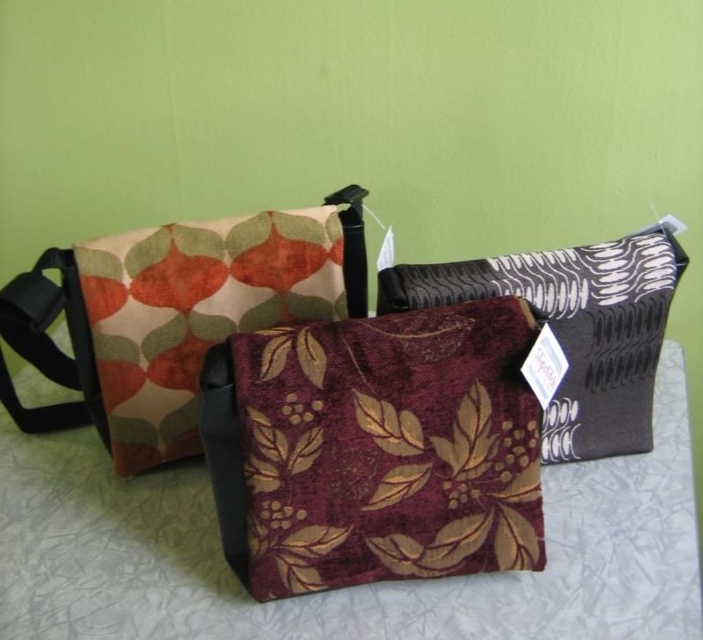
Is burgundy velvety pouch at center smaller than burgundy velvet pouch at center?

Yes.

Can you confirm if burgundy velvety pouch at center is bigger than burgundy velvet pouch at center?

No.

Does point (200, 387) come farther from viewer compared to point (645, 362)?

No, (200, 387) is in front of (645, 362).

This screenshot has width=703, height=640. In order to click on burgundy velvety pouch at center in this screenshot , I will do `click(375, 449)`.

Which is more to the left, burgundy velvet pouch at center or velvety floral pouch at center?

velvety floral pouch at center

Does burgundy velvet pouch at center have a lesser height compared to velvety floral pouch at center?

Yes, burgundy velvet pouch at center is shorter than velvety floral pouch at center.

Between point (654, 307) and point (34, 336), which one is positioned behind?

Positioned behind is point (34, 336).

Find the location of a particular element. Image resolution: width=703 pixels, height=640 pixels. burgundy velvet pouch at center is located at coordinates (574, 326).

Can you confirm if burgundy velvety pouch at center is positioned to the left of velvety floral pouch at center?

No, burgundy velvety pouch at center is not to the left of velvety floral pouch at center.

The height and width of the screenshot is (640, 703). In order to click on burgundy velvety pouch at center in this screenshot , I will do `click(375, 449)`.